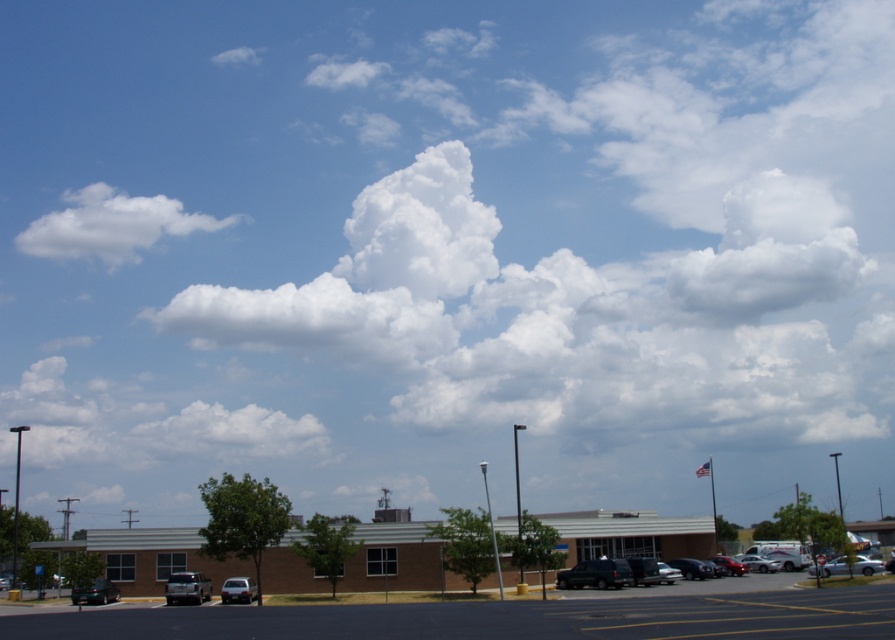
Between black asphalt parking lot at lower center and matte black suv at center, which one has more height?

With more height is black asphalt parking lot at lower center.

Does black asphalt parking lot at lower center have a larger size compared to matte black suv at center?

Indeed, black asphalt parking lot at lower center has a larger size compared to matte black suv at center.

This screenshot has height=640, width=895. Describe the element at coordinates (497, 618) in the screenshot. I see `black asphalt parking lot at lower center` at that location.

This screenshot has height=640, width=895. Find the location of `black asphalt parking lot at lower center`. black asphalt parking lot at lower center is located at coordinates (497, 618).

Does black asphalt parking lot at lower center lie in front of shiny silver sedan at center?

Yes, black asphalt parking lot at lower center is closer to the viewer.

Which is behind, point (865, 627) or point (658, 564)?

The point (658, 564) is behind.

Between point (834, 600) and point (659, 568), which one is positioned behind?

Point (659, 568)

Locate an element on the screen. The width and height of the screenshot is (895, 640). black asphalt parking lot at lower center is located at coordinates (497, 618).

Is matte black suv at center bigger than metallic silver sedan at lower right?

Yes, matte black suv at center is bigger than metallic silver sedan at lower right.

Does matte black suv at center appear on the left side of metallic silver sedan at lower right?

Yes, matte black suv at center is to the left of metallic silver sedan at lower right.

Does point (597, 582) come farther from viewer compared to point (760, 560)?

That is False.

Where is `matte black suv at center`? matte black suv at center is located at coordinates click(x=595, y=573).